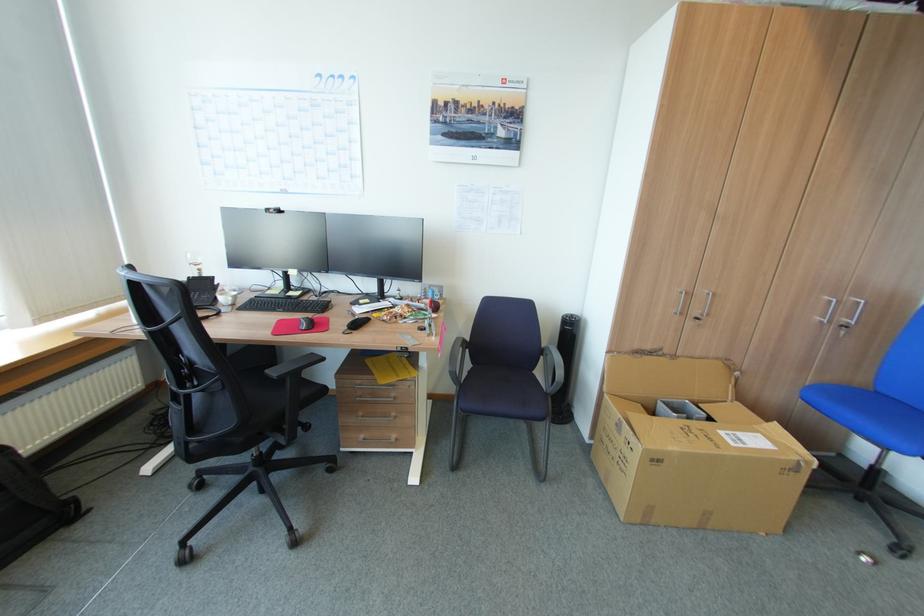
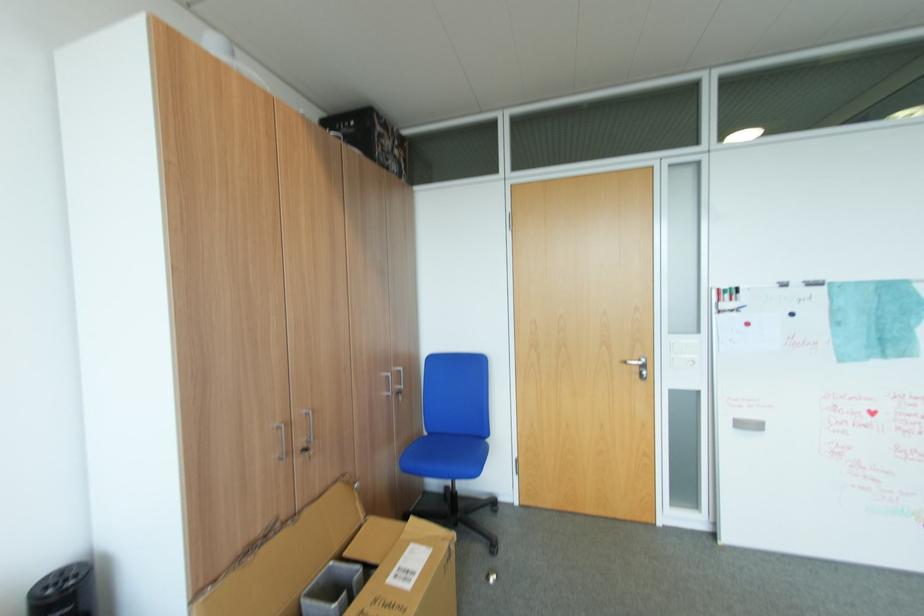
Locate, in the second image, the point that corresponds to point (800, 458) in the first image.

(451, 544)